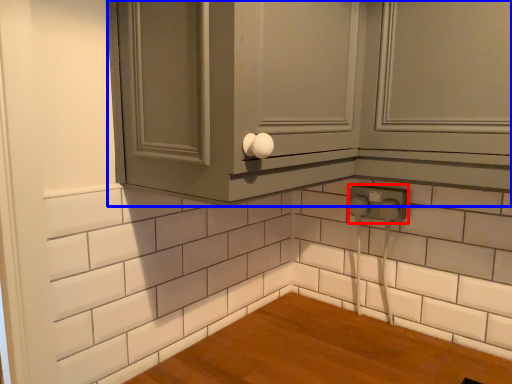
Question: Which object is closer to the camera taking this photo, electric outlet (highlighted by a red box) or cabinetry (highlighted by a blue box)?

Choices:
 (A) electric outlet
 (B) cabinetry

Answer: (B)